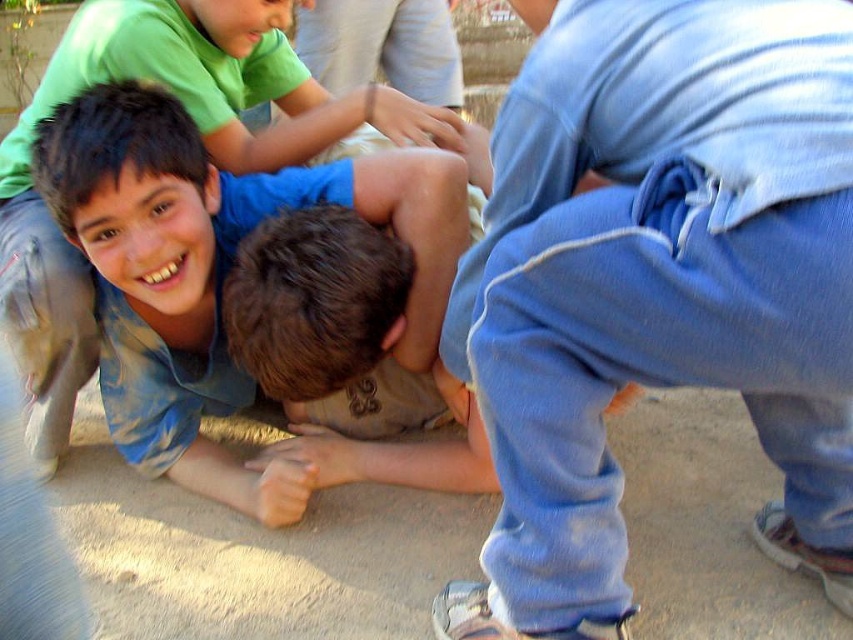
Question: Which point is farther to the camera?

Choices:
 (A) blue tie-dye shirt at center
 (B) blue sweatpants at lower right

Answer: (A)

Question: Is the position of blue sweatpants at lower right more distant than that of blue tie-dye shirt at center?

Choices:
 (A) yes
 (B) no

Answer: (B)

Question: Which of the following is the closest to the observer?

Choices:
 (A) [538, 244]
 (B) [25, 381]

Answer: (A)

Question: Observing the image, what is the correct spatial positioning of blue sweatpants at lower right in reference to blue tie-dye shirt at center?

Choices:
 (A) left
 (B) right

Answer: (B)

Question: Can you confirm if blue sweatpants at lower right is positioned to the right of blue tie-dye shirt at center?

Choices:
 (A) yes
 (B) no

Answer: (A)